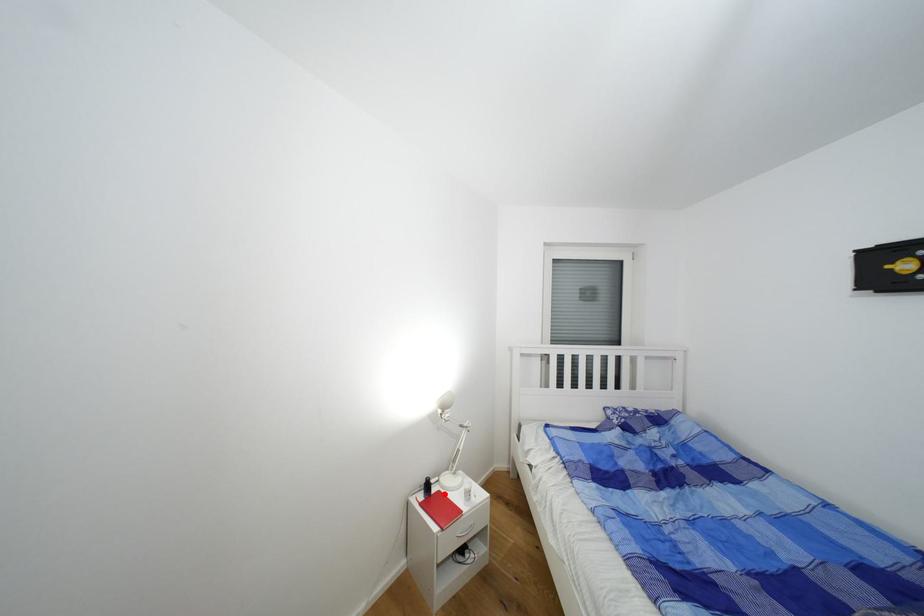
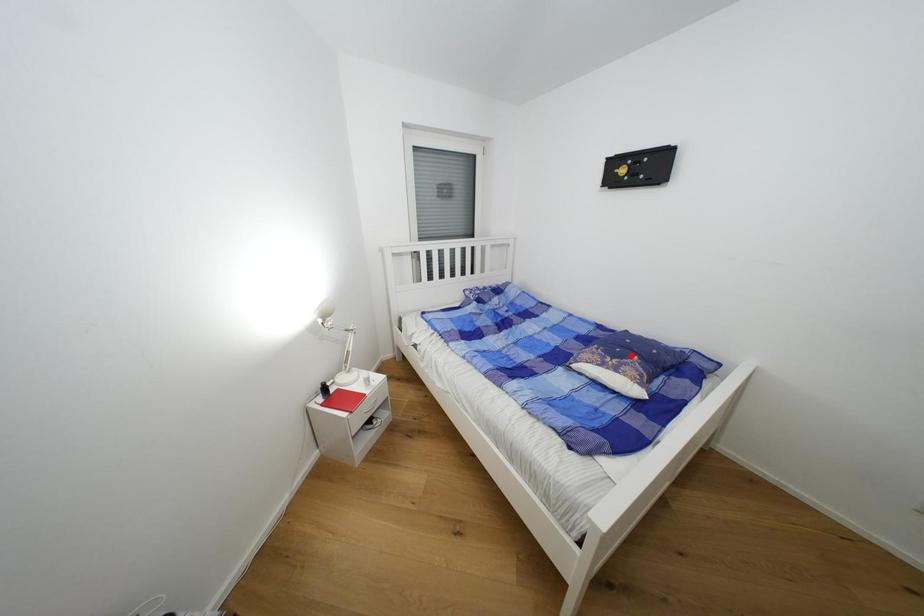
I am providing you with two images of the same scene from different viewpoints. A red point is marked on the first image and another point is marked on the second image. Does the point marked in image1 correspond to the same location as the one in image2?

No